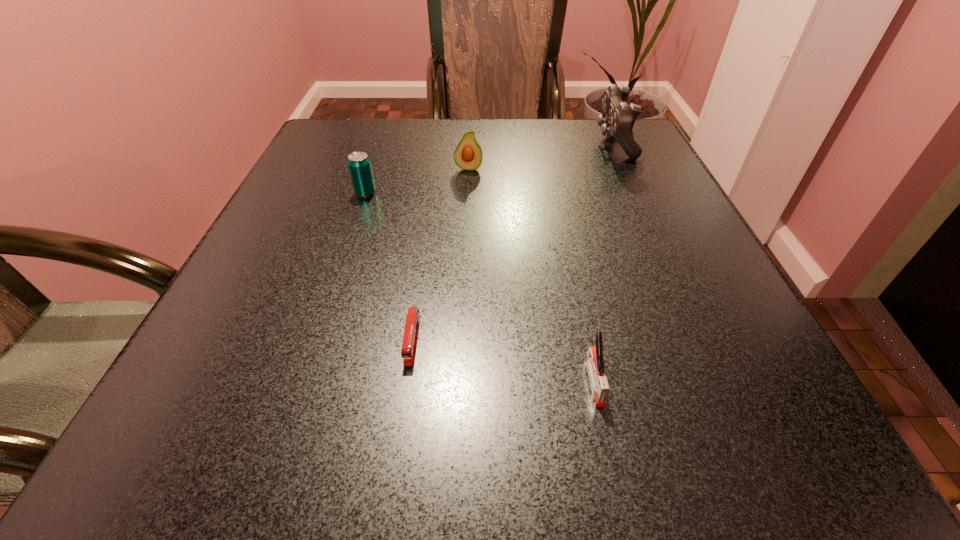
You are a GUI agent. You are given a task and a screenshot of the screen. Output one action in this format:
    pyautogui.click(x=<x>, y=<y>)
    Task: Click on the free space that satisfies the following two spatial constraints: 1. on the surface of the tallest object with buttons; 2. on the front side of the third farthest object
    
    Given the screenshot: What is the action you would take?
    pyautogui.click(x=636, y=193)

This screenshot has width=960, height=540. Find the location of `blank space that satisfies the following two spatial constraints: 1. on the surface of the control with buttons; 2. on the cut side of the third object from right to left`. blank space that satisfies the following two spatial constraints: 1. on the surface of the control with buttons; 2. on the cut side of the third object from right to left is located at coordinates (625, 168).

Where is `vacant region that satisfies the following two spatial constraints: 1. on the surface of the tallest object with buttons; 2. on the cut side of the avocado`? This screenshot has width=960, height=540. vacant region that satisfies the following two spatial constraints: 1. on the surface of the tallest object with buttons; 2. on the cut side of the avocado is located at coordinates (625, 168).

Where is `free location that satisfies the following two spatial constraints: 1. on the surface of the tallest object with buttons; 2. on the front side of the leftmost object`? free location that satisfies the following two spatial constraints: 1. on the surface of the tallest object with buttons; 2. on the front side of the leftmost object is located at coordinates (636, 193).